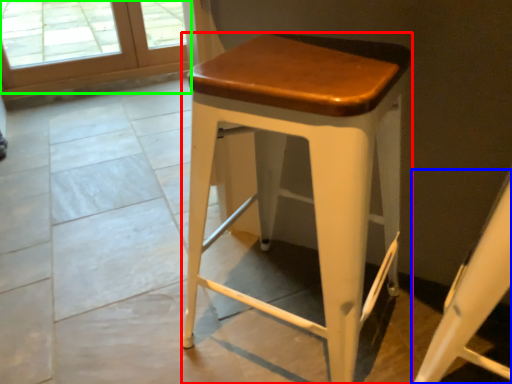
Question: Which object is the farthest from stool (highlighted by a red box)? Choose among these: swivel chair (highlighted by a blue box) or screen door (highlighted by a green box).

Choices:
 (A) swivel chair
 (B) screen door

Answer: (B)